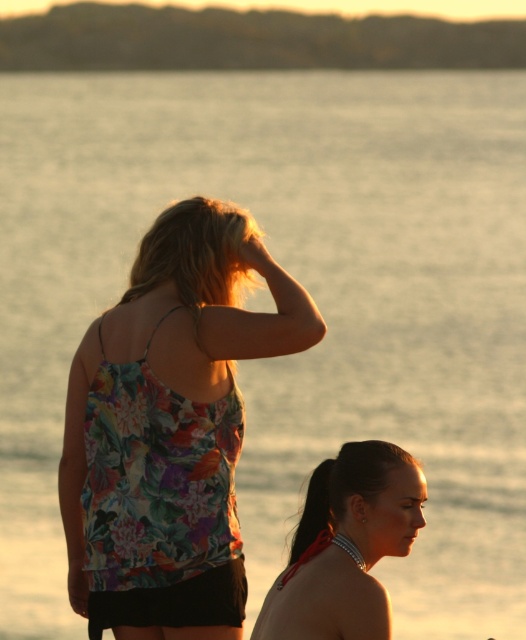
From the picture: Is floral fabric tank top at upper left closer to camera compared to floral print fabric bikini top at upper left?

That is True.

Which is behind, point (156, 461) or point (126, 372)?

The point (156, 461) is more distant.

This screenshot has width=526, height=640. What do you see at coordinates (169, 413) in the screenshot?
I see `floral fabric tank top at upper left` at bounding box center [169, 413].

Find the location of a particular element. The image size is (526, 640). floral fabric tank top at upper left is located at coordinates (169, 413).

From the picture: Between floral print fabric bikini top at upper left and matte floral tank top at lower center, which one has more height?

floral print fabric bikini top at upper left

Is the position of floral print fabric bikini top at upper left less distant than that of matte floral tank top at lower center?

No, it is not.

Is point (149, 572) farther from viewer compared to point (318, 500)?

That is False.

I want to click on floral print fabric bikini top at upper left, so pos(156,477).

Can you confirm if floral fabric tank top at upper left is positioned above matte floral tank top at lower center?

Yes.

Can you confirm if floral fabric tank top at upper left is smaller than matte floral tank top at lower center?

Actually, floral fabric tank top at upper left might be larger than matte floral tank top at lower center.

Is point (252, 256) closer to viewer compared to point (316, 636)?

That is False.

Identify the location of floral fabric tank top at upper left. The height and width of the screenshot is (640, 526). (169, 413).